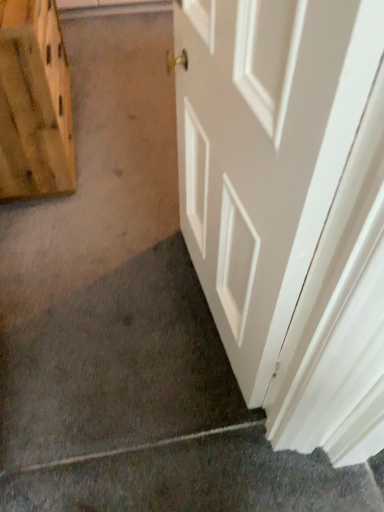
Question: Can you confirm if wooden plank at left is bigger than white glossy door at center?

Choices:
 (A) no
 (B) yes

Answer: (B)

Question: Considering the relative sizes of wooden plank at left and white glossy door at center in the image provided, is wooden plank at left taller than white glossy door at center?

Choices:
 (A) yes
 (B) no

Answer: (B)

Question: Is wooden plank at left outside white glossy door at center?

Choices:
 (A) yes
 (B) no

Answer: (A)

Question: Is wooden plank at left thinner than white glossy door at center?

Choices:
 (A) no
 (B) yes

Answer: (A)

Question: Is wooden plank at left in front of white glossy door at center?

Choices:
 (A) no
 (B) yes

Answer: (A)

Question: Considering the relative positions of wooden plank at left and white glossy door at center in the image provided, is wooden plank at left behind white glossy door at center?

Choices:
 (A) yes
 (B) no

Answer: (A)

Question: From the image's perspective, is gray matte concrete at lower left over wooden plank at left?

Choices:
 (A) yes
 (B) no

Answer: (B)

Question: From a real-world perspective, is gray matte concrete at lower left below wooden plank at left?

Choices:
 (A) no
 (B) yes

Answer: (B)

Question: From a real-world perspective, is gray matte concrete at lower left on top of wooden plank at left?

Choices:
 (A) no
 (B) yes

Answer: (A)

Question: Is gray matte concrete at lower left closer to the viewer compared to wooden plank at left?

Choices:
 (A) yes
 (B) no

Answer: (A)

Question: Is gray matte concrete at lower left next to wooden plank at left and touching it?

Choices:
 (A) no
 (B) yes

Answer: (A)

Question: Could you tell me if gray matte concrete at lower left is facing wooden plank at left?

Choices:
 (A) no
 (B) yes

Answer: (A)

Question: Is white glossy door at center positioned beyond the bounds of wooden plank at left?

Choices:
 (A) no
 (B) yes

Answer: (B)